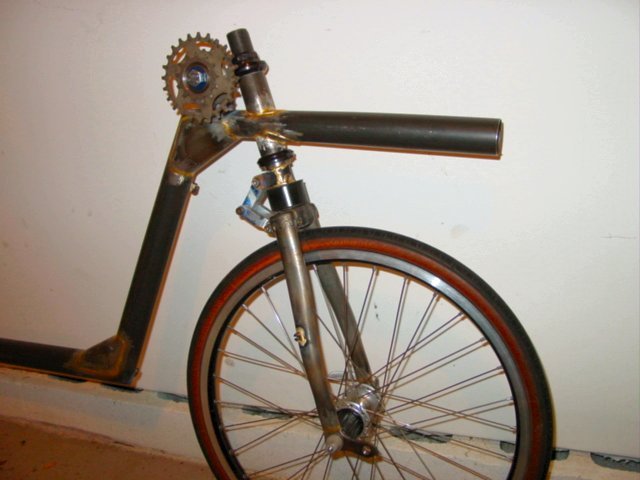
The image size is (640, 480). What are the coordinates of `white wall` in the screenshot? It's located at (584, 260).